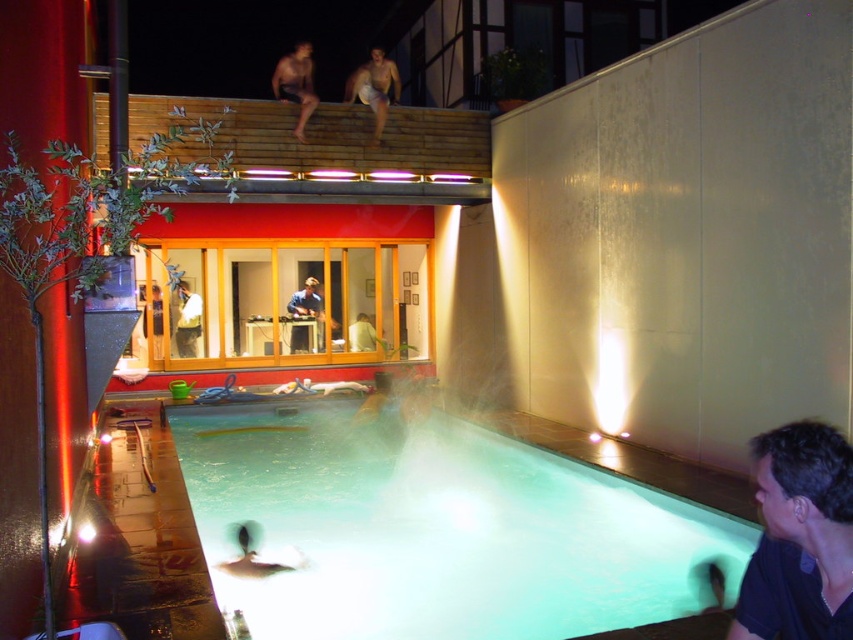
From the picture: You are standing on the tiled deck by the pool and want to find the dark blue shirt at lower right and the skinny man at upper center. Which one is closer to the pool?

The dark blue shirt at lower right is closer to the pool because it is positioned under the skinny man at upper center, indicating it is lower in the scene.

You are standing at the edge of the swimming pool in the image and want to locate the person wearing the dark blue shirt at lower right. In which direction should you look relative to your position?

The dark blue shirt at lower right is located at point [799,538], which corresponds to the lower right direction from your current position at the pool edge.

You are standing at the edge of the swimming pool and see two people wearing shirts. One is wearing a dark blue shirt at lower right and the other a blue fabric shirt at center. Which person is shorter?

The dark blue shirt at lower right has a lesser height compared to blue fabric shirt at center, so the person wearing the dark blue shirt at lower right is shorter.